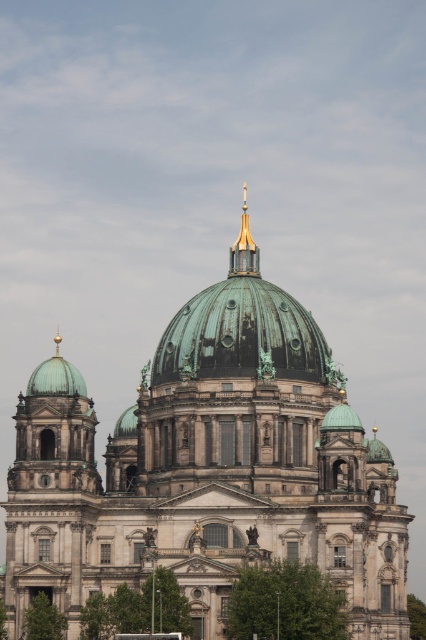
Does green copper dome at center have a lesser width compared to gold polished metal spire at upper center?

No, green copper dome at center is not thinner than gold polished metal spire at upper center.

I want to click on green copper dome at center, so click(207, 470).